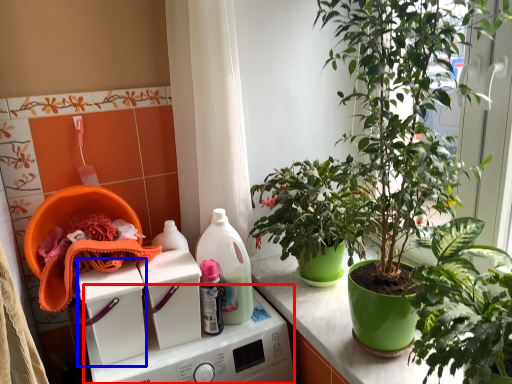
Question: Which object appears closest to the camera in this image, washing machine (highlighted by a red box) or washing machine (highlighted by a blue box)?

Choices:
 (A) washing machine
 (B) washing machine

Answer: (A)